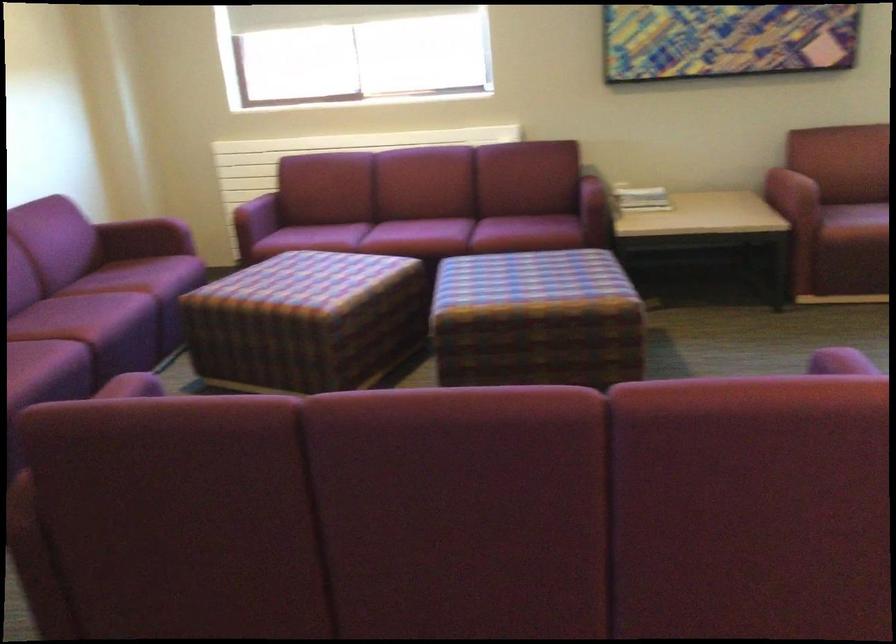
The height and width of the screenshot is (644, 896). What do you see at coordinates (840, 362) in the screenshot?
I see `the purple sofa armrest` at bounding box center [840, 362].